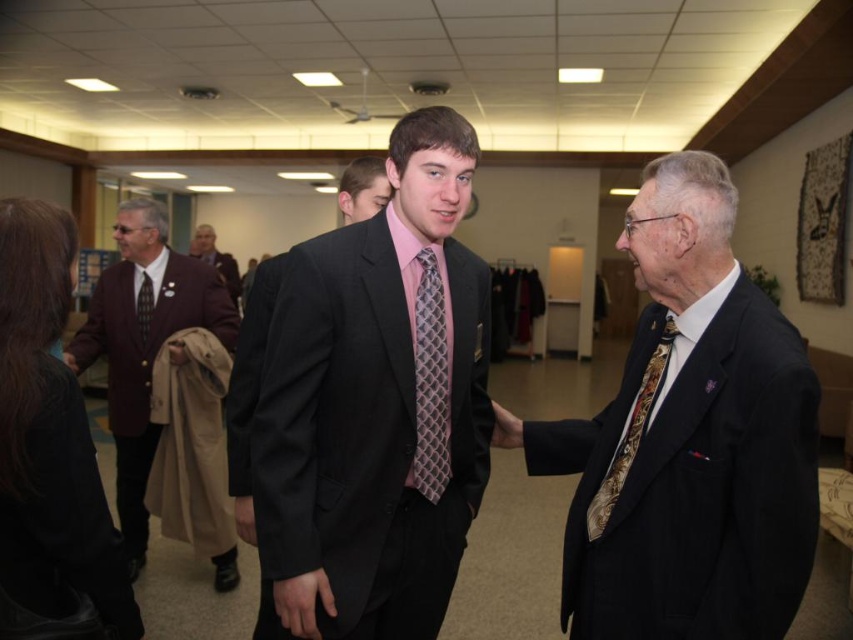
Question: In this image, where is maroon wool blazer at left located relative to gold-patterned tie at right?

Choices:
 (A) left
 (B) right

Answer: (A)

Question: Can you confirm if matte black suit at center is smaller than pink textured tie at center?

Choices:
 (A) yes
 (B) no

Answer: (B)

Question: Which point is closer to the camera?

Choices:
 (A) (213, 260)
 (B) (351, 176)

Answer: (B)

Question: Among these points, which one is nearest to the camera?

Choices:
 (A) (149, 310)
 (B) (305, 572)
 (C) (126, 259)

Answer: (B)

Question: Can you confirm if pink textured tie at center is positioned below gold-patterned tie at right?

Choices:
 (A) no
 (B) yes

Answer: (A)

Question: Estimate the real-world distances between objects in this image. Which object is farther from the black suit at right?

Choices:
 (A) gold-patterned tie at right
 (B) light brown leather jacket at upper left
 (C) matte black suit at center

Answer: (B)